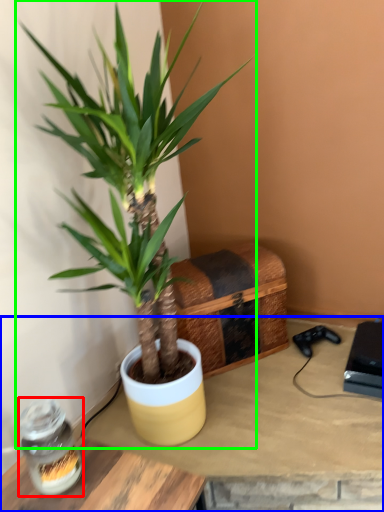
Question: Based on their relative distances, which object is nearer to glass jar (highlighted by a red box)? Choose from table (highlighted by a blue box) and houseplant (highlighted by a green box).

Choices:
 (A) table
 (B) houseplant

Answer: (A)